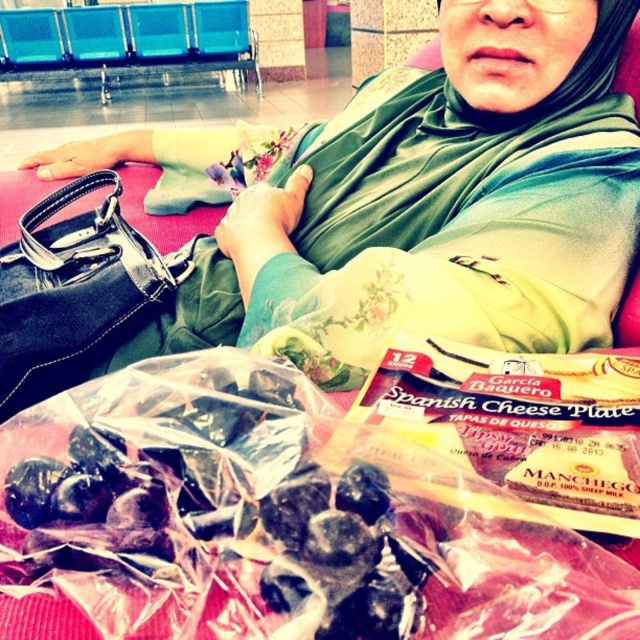
Is green fabric scarf at upper center to the right of black leather handbag at left from the viewer's perspective?

Correct, you'll find green fabric scarf at upper center to the right of black leather handbag at left.

Does green fabric scarf at upper center have a lesser height compared to black leather handbag at left?

Incorrect, green fabric scarf at upper center's height does not fall short of black leather handbag at left's.

Identify the location of green fabric scarf at upper center. (440, 205).